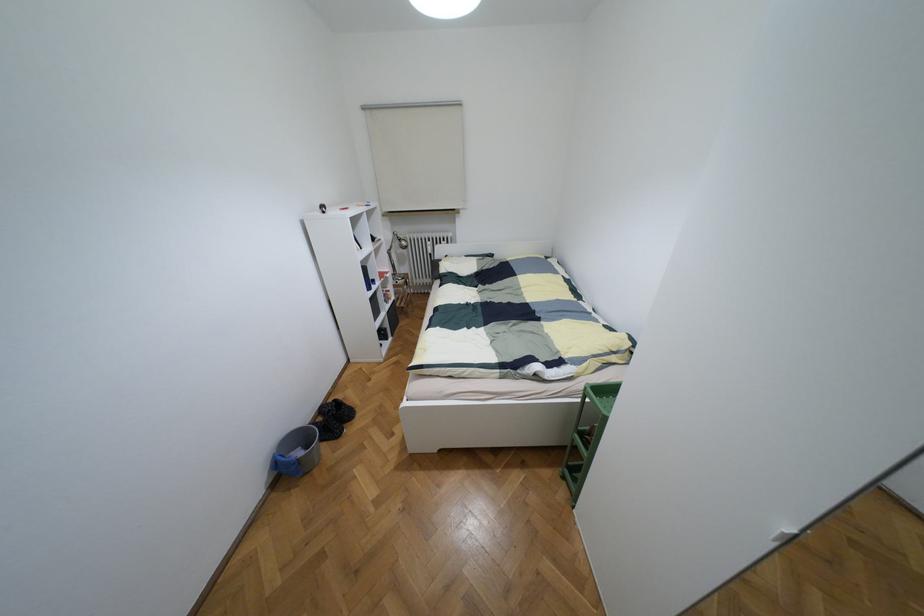
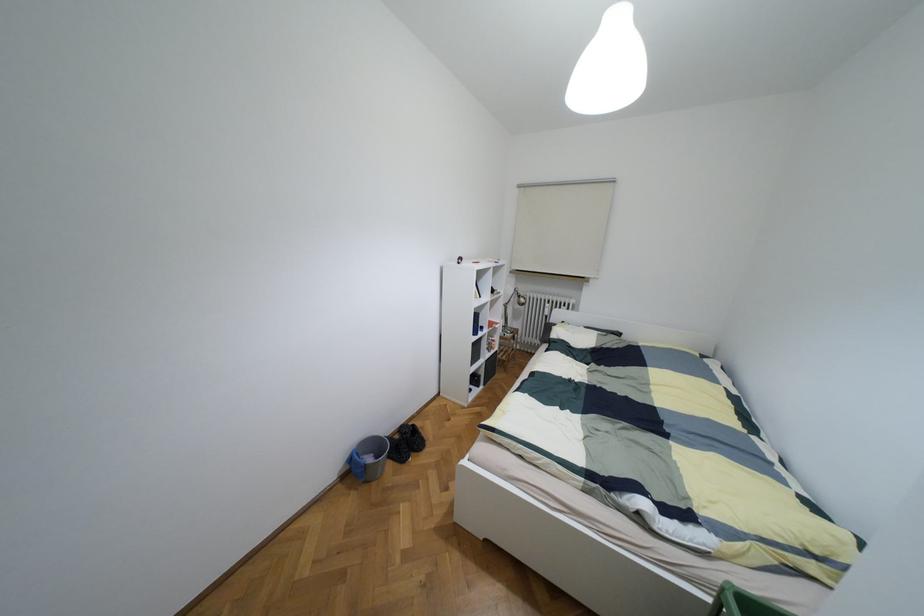
The point at (398,238) is marked in the first image. Where is the corresponding point in the second image?

(517, 296)